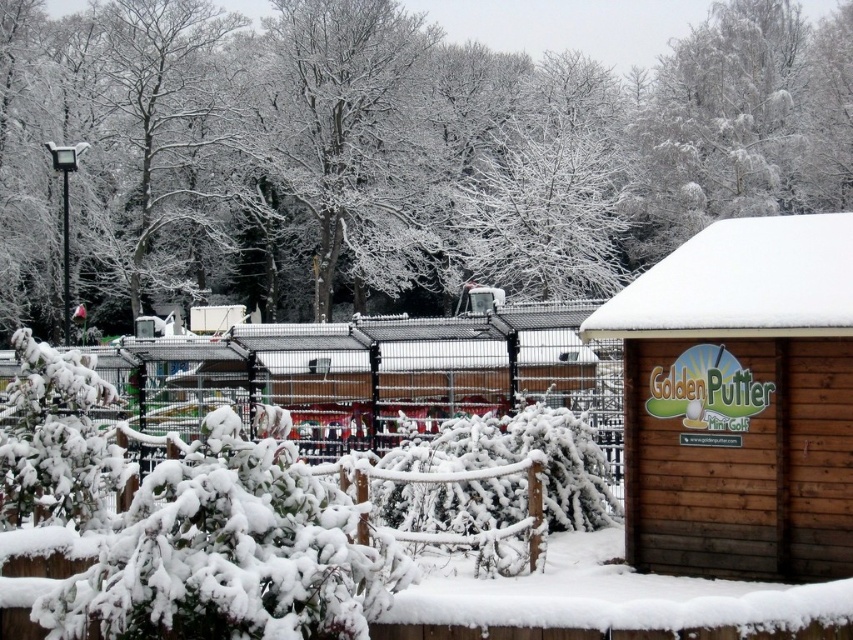
Question: Which of the following is the farthest from the observer?

Choices:
 (A) wooden hut at right
 (B) white frosty tree at upper center

Answer: (B)

Question: Can you confirm if wooden hut at right is positioned to the right of white frosty tree at upper center?

Choices:
 (A) no
 (B) yes

Answer: (A)

Question: Can you confirm if wooden hut at right is positioned below white frosty tree at upper center?

Choices:
 (A) yes
 (B) no

Answer: (A)

Question: Which point appears closest to the camera in this image?

Choices:
 (A) (693, 192)
 (B) (834, 372)

Answer: (B)

Question: Is wooden hut at right above white frosty tree at upper center?

Choices:
 (A) yes
 (B) no

Answer: (B)